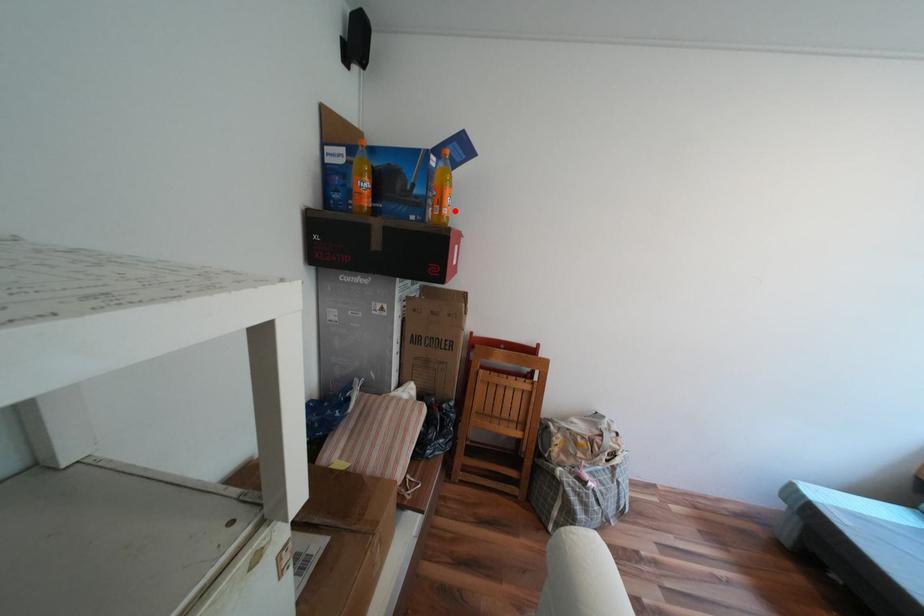
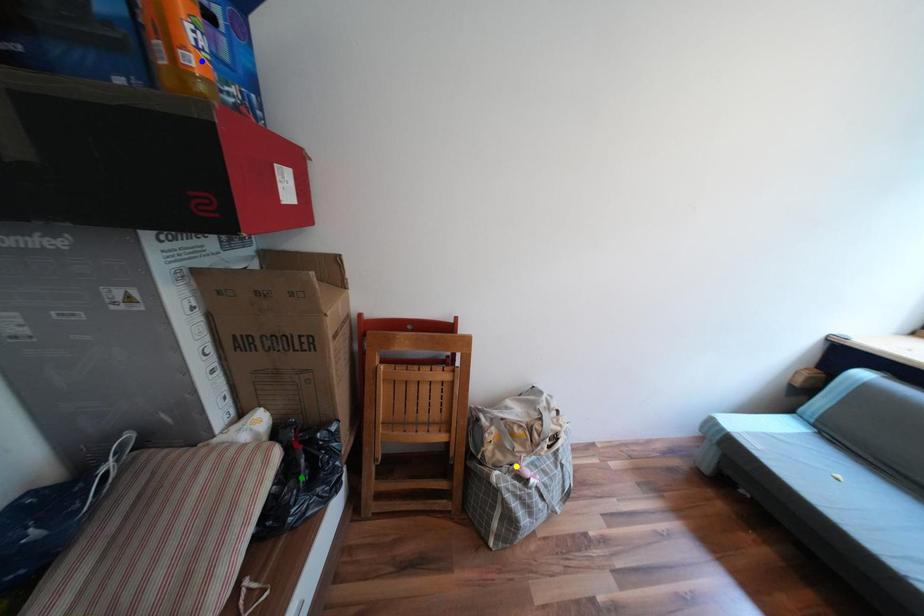
Question: I am providing you with two images of the same scene from different viewpoints. A red point is marked on the first image. You are given multiple points on the second image. Which point in image 2 represents the same 3d spot as the red point in image 1?

Choices:
 (A) green point
 (B) blue point
 (C) yellow point

Answer: (B)